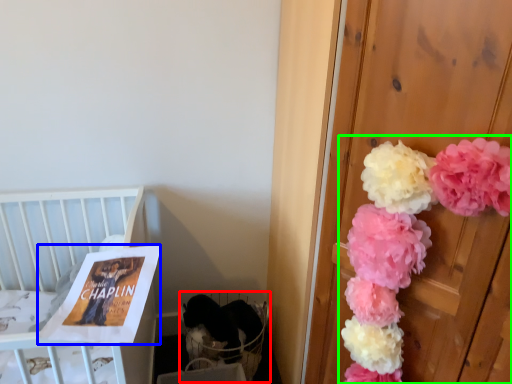
Question: Which object is the farthest from baby carriage (highlighted by a red box)? Choose among these: magazine (highlighted by a blue box) or floral arrangement (highlighted by a green box).

Choices:
 (A) magazine
 (B) floral arrangement

Answer: (B)